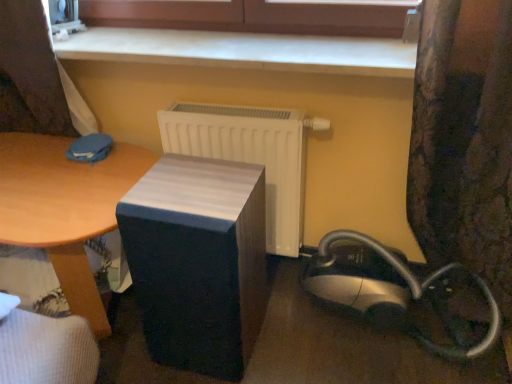
Question: Can you confirm if matte black speaker at center is smaller than floral fabric curtain at right?

Choices:
 (A) no
 (B) yes

Answer: (B)

Question: From a real-world perspective, does matte black speaker at center stand above floral fabric curtain at right?

Choices:
 (A) yes
 (B) no

Answer: (B)

Question: Considering the relative sizes of matte black speaker at center and floral fabric curtain at right in the image provided, is matte black speaker at center wider than floral fabric curtain at right?

Choices:
 (A) yes
 (B) no

Answer: (B)

Question: Can you see matte black speaker at center touching floral fabric curtain at right?

Choices:
 (A) yes
 (B) no

Answer: (B)

Question: Is matte black speaker at center bigger than floral fabric curtain at right?

Choices:
 (A) yes
 (B) no

Answer: (B)

Question: Would you say matte black speaker at center is to the left or to the right of wooden table at center in the picture?

Choices:
 (A) right
 (B) left

Answer: (A)

Question: Is matte black speaker at center in front of or behind wooden table at center in the image?

Choices:
 (A) front
 (B) behind

Answer: (A)

Question: Would you say matte black speaker at center is inside or outside wooden table at center?

Choices:
 (A) outside
 (B) inside

Answer: (A)

Question: From a real-world perspective, relative to wooden table at center, is matte black speaker at center vertically above or below?

Choices:
 (A) below
 (B) above

Answer: (B)

Question: Is point (212, 195) positioned closer to the camera than point (374, 324)?

Choices:
 (A) farther
 (B) closer

Answer: (B)

Question: Considering the positions of matte black speaker at center and silver/black plastic vacuum cleaner at lower right in the image, is matte black speaker at center taller or shorter than silver/black plastic vacuum cleaner at lower right?

Choices:
 (A) tall
 (B) short

Answer: (A)

Question: Would you say matte black speaker at center is inside or outside silver/black plastic vacuum cleaner at lower right?

Choices:
 (A) outside
 (B) inside

Answer: (A)

Question: Visually, is matte black speaker at center positioned to the left or to the right of silver/black plastic vacuum cleaner at lower right?

Choices:
 (A) left
 (B) right

Answer: (A)

Question: Is smooth wood surface at upper center taller or shorter than silver/black plastic vacuum cleaner at lower right?

Choices:
 (A) short
 (B) tall

Answer: (A)

Question: Would you say smooth wood surface at upper center is inside or outside silver/black plastic vacuum cleaner at lower right?

Choices:
 (A) inside
 (B) outside

Answer: (B)